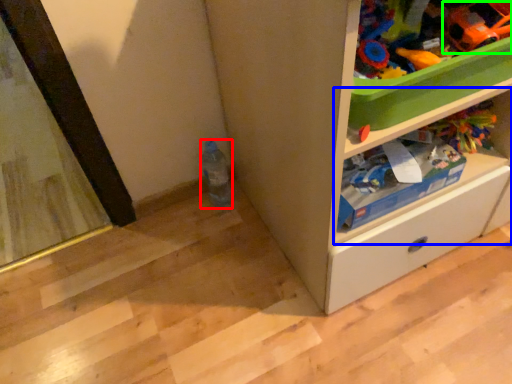
Question: Based on their relative distances, which object is nearer to bottle (highlighted by a red box)? Choose from shelf (highlighted by a blue box) and toy (highlighted by a green box).

Choices:
 (A) shelf
 (B) toy

Answer: (A)